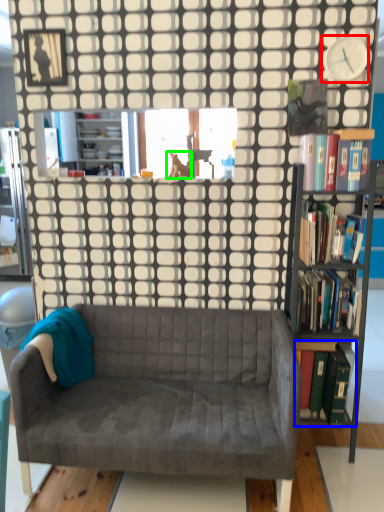
Question: Considering the real-world distances, which object is closest to clock (highlighted by a red box)? book (highlighted by a blue box) or animal (highlighted by a green box).

Choices:
 (A) book
 (B) animal

Answer: (B)